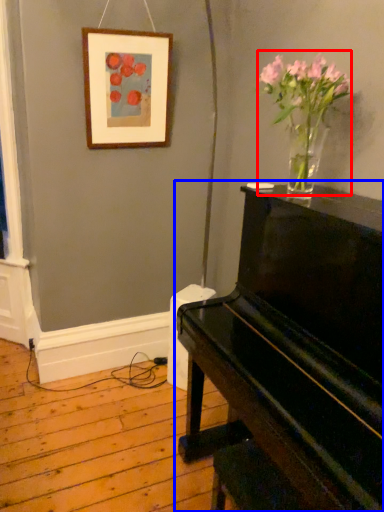
Question: Among these objects, which one is farthest to the camera, floral arrangement (highlighted by a red box) or piano (highlighted by a blue box)?

Choices:
 (A) floral arrangement
 (B) piano

Answer: (A)